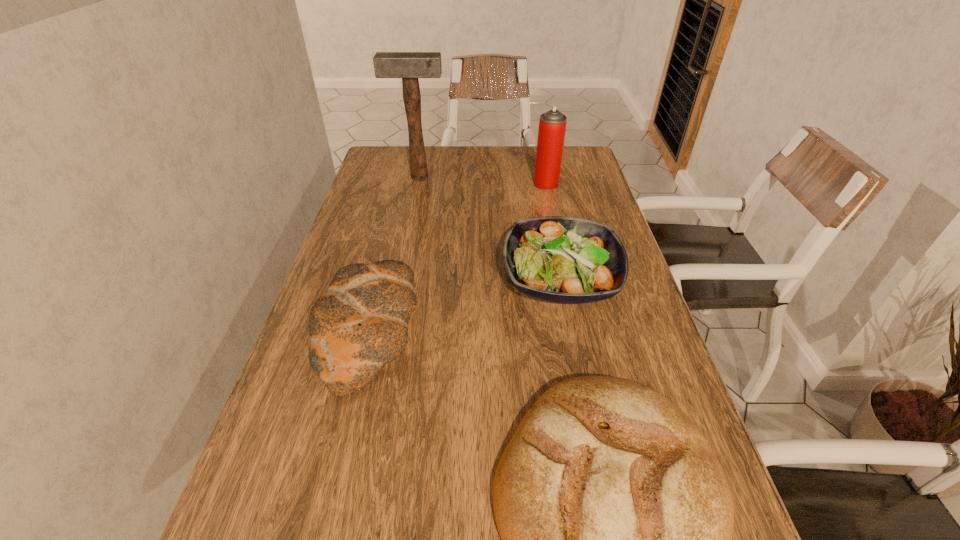
Locate an element on the screen. Image resolution: width=960 pixels, height=540 pixels. free space between the fourth shortest object and the left bread is located at coordinates (457, 257).

Find the location of a particular element. The width and height of the screenshot is (960, 540). empty space that is in between the mallet and the salad plate is located at coordinates (490, 228).

The height and width of the screenshot is (540, 960). I want to click on unoccupied area between the salad plate and the left bread, so click(x=465, y=305).

Where is `free area in between the left bread and the salad plate`? This screenshot has width=960, height=540. free area in between the left bread and the salad plate is located at coordinates (465, 305).

Identify the location of free space between the mallet and the salad plate. (490, 228).

Where is `empty space between the left bread and the aerosol can`? The width and height of the screenshot is (960, 540). empty space between the left bread and the aerosol can is located at coordinates (457, 257).

Identify which object is the third closest to the right bread. Please provide its 2D coordinates. Your answer should be formatted as a tuple, i.e. [(x, y)], where the tuple contains the x and y coordinates of a point satisfying the conditions above.

[(552, 125)]

You are a GUI agent. You are given a task and a screenshot of the screen. Output one action in this format:
    pyautogui.click(x=<x>, y=<y>)
    Task: Click on the object identified as the closest to the right bread
    
    Given the screenshot: What is the action you would take?
    pyautogui.click(x=359, y=325)

Locate an element on the screen. The width and height of the screenshot is (960, 540). free space that satisfies the following two spatial constraints: 1. on the back side of the mallet; 2. on the left side of the left bread is located at coordinates (406, 177).